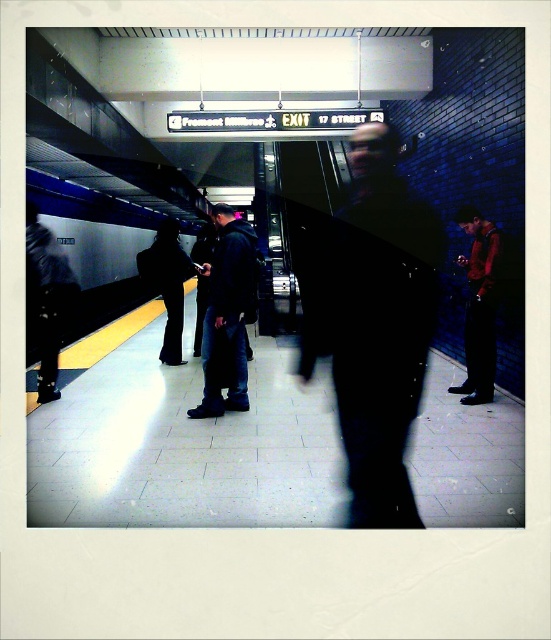
You are standing in the subway station and want to locate the metallic silver platform at center. Based on its 2 dimensional coordinates, where would you find it?

The metallic silver platform at center is located at the 2D coordinates point [197,401].